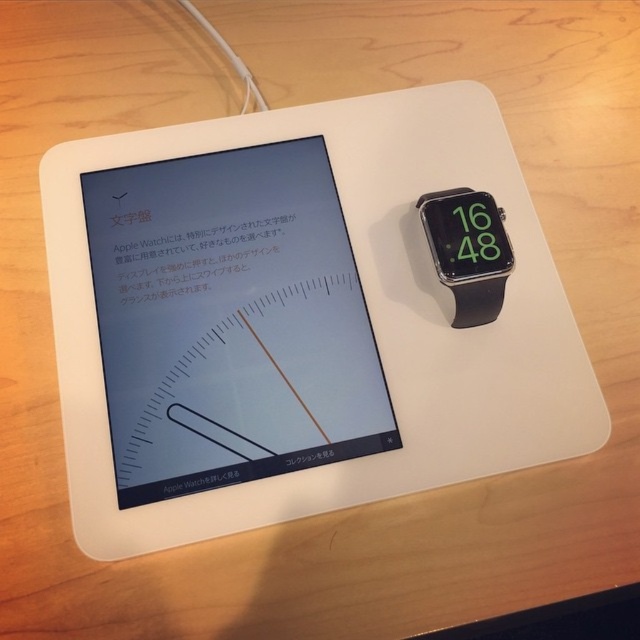
Measure the distance from matte black tablet at left to black rubber watch at upper right.

matte black tablet at left is 16.49 centimeters from black rubber watch at upper right.

The image size is (640, 640). Find the location of `matte black tablet at left`. matte black tablet at left is located at coordinates (230, 321).

Which is in front, point (156, 340) or point (465, 323)?

Point (156, 340) is in front.

Where is `matte black tablet at left`? This screenshot has width=640, height=640. matte black tablet at left is located at coordinates (230, 321).